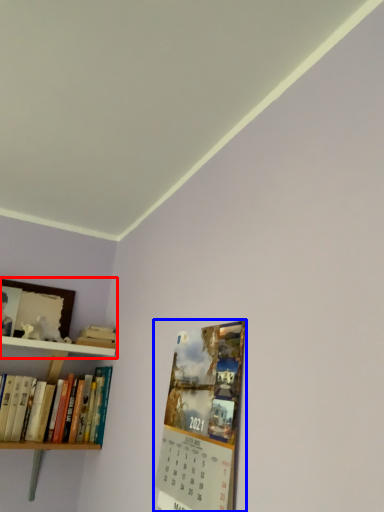
Question: Among these objects, which one is nearest to the camera, shelf (highlighted by a red box) or magazine (highlighted by a blue box)?

Choices:
 (A) shelf
 (B) magazine

Answer: (B)